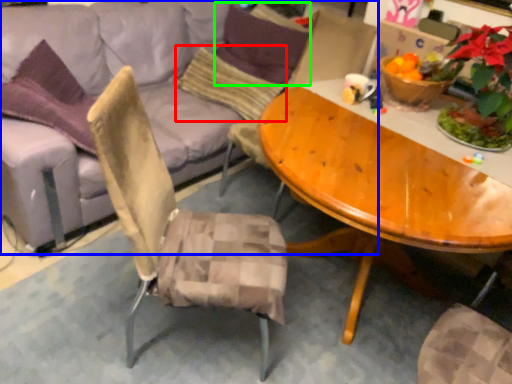
Question: Which is farther away from pillow (highlighted by a red box)? studio couch (highlighted by a blue box) or pillow (highlighted by a green box)?

Choices:
 (A) studio couch
 (B) pillow

Answer: (B)